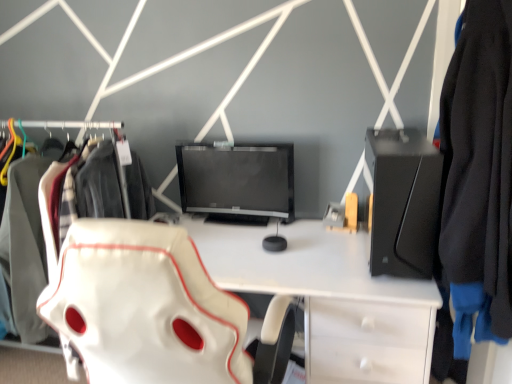
This screenshot has width=512, height=384. Identify the location of free location to the left of black matte desktop at right. (327, 256).